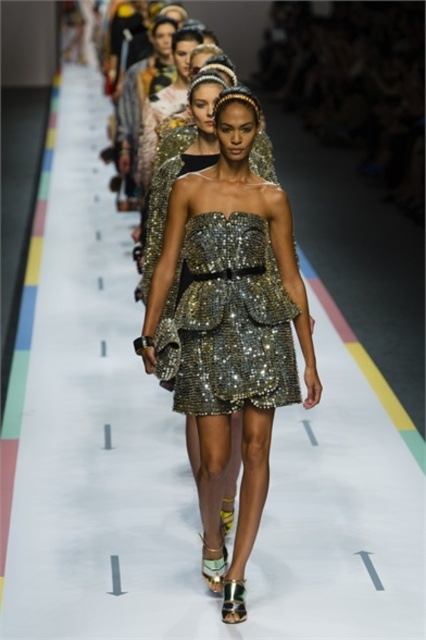
Does sparkly metallic dress at center lie in front of shiny sequined dress at center?

Yes, it is.

Is sparkly metallic dress at center taller than shiny sequined dress at center?

Yes.

Is point (238, 305) behind point (206, 269)?

No, (238, 305) is closer to viewer.

Image resolution: width=426 pixels, height=640 pixels. Identify the location of sparkly metallic dress at center. (233, 328).